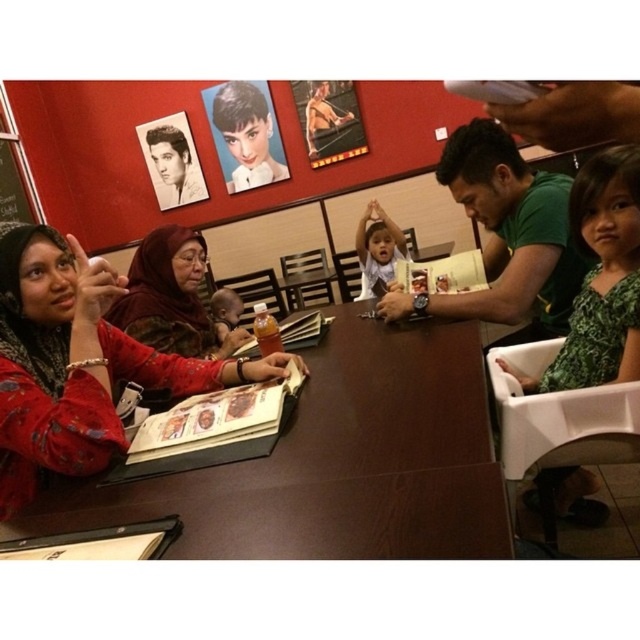
Between brown wooden table at center and matte red dress at left, which one is positioned higher?

matte red dress at left is higher up.

Can you confirm if brown wooden table at center is thinner than matte red dress at left?

No, brown wooden table at center is not thinner than matte red dress at left.

Between point (333, 492) and point (104, 404), which one is positioned in front?

Point (333, 492) is more forward.

This screenshot has height=640, width=640. What are the coordinates of `brown wooden table at center` in the screenshot? It's located at (336, 464).

Does green floral dress at lower right appear under translucent plastic cup at table center?

No, green floral dress at lower right is not below translucent plastic cup at table center.

Can you confirm if green floral dress at lower right is positioned to the left of translucent plastic cup at table center?

No, green floral dress at lower right is not to the left of translucent plastic cup at table center.

Describe the element at coordinates (600, 280) in the screenshot. This screenshot has height=640, width=640. I see `green floral dress at lower right` at that location.

Where is `green floral dress at lower right`? green floral dress at lower right is located at coordinates (600, 280).

Between matte red dress at left and translucent plastic cup at table center, which one appears on the right side from the viewer's perspective?

translucent plastic cup at table center

Can you confirm if matte red dress at left is taller than translucent plastic cup at table center?

Yes, matte red dress at left is taller than translucent plastic cup at table center.

Which is in front, point (13, 481) or point (253, 321)?

Point (13, 481) is in front.

You are a GUI agent. You are given a task and a screenshot of the screen. Output one action in this format:
    pyautogui.click(x=<x>, y=<y>)
    Task: Click on the matte red dress at left
    The image size is (640, 640).
    Given the screenshot: What is the action you would take?
    pyautogui.click(x=77, y=364)